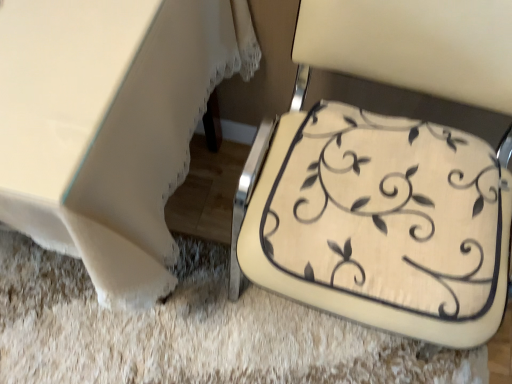
Question: In the image, is beige fabric cushion at lower right positioned in front of or behind white fabric table at lower left?

Choices:
 (A) behind
 (B) front

Answer: (B)

Question: Considering the positions of beige fabric cushion at lower right and white fabric table at lower left in the image, is beige fabric cushion at lower right wider or thinner than white fabric table at lower left?

Choices:
 (A) wide
 (B) thin

Answer: (B)

Question: From the image's perspective, is beige fabric cushion at lower right located above or below white fabric table at lower left?

Choices:
 (A) above
 (B) below

Answer: (B)

Question: Relative to beige fabric cushion at lower right, is white fabric table at lower left in front or behind?

Choices:
 (A) behind
 (B) front

Answer: (A)

Question: Considering the positions of point (98, 233) and point (456, 77), is point (98, 233) closer or farther from the camera than point (456, 77)?

Choices:
 (A) farther
 (B) closer

Answer: (B)

Question: From the image's perspective, relative to beige fabric cushion at lower right, is white fabric table at lower left above or below?

Choices:
 (A) above
 (B) below

Answer: (A)

Question: From a real-world perspective, is white fabric table at lower left positioned above or below beige fabric cushion at lower right?

Choices:
 (A) below
 (B) above

Answer: (A)